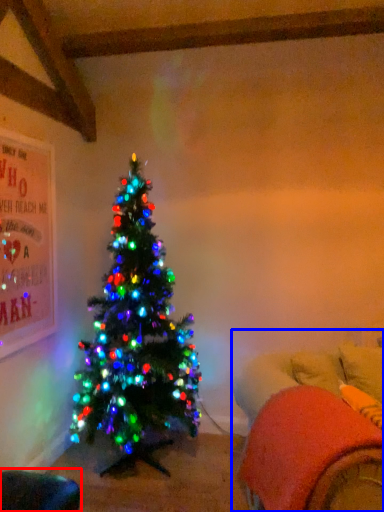
Question: Among these objects, which one is nearest to the camera, bean bag chair (highlighted by a red box) or bean bag chair (highlighted by a blue box)?

Choices:
 (A) bean bag chair
 (B) bean bag chair

Answer: (B)